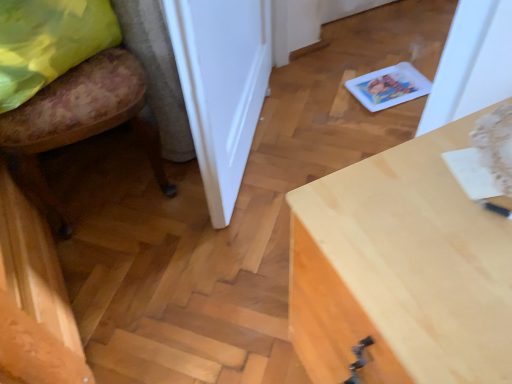
The image size is (512, 384). Describe the element at coordinates (221, 86) in the screenshot. I see `white glossy door at center` at that location.

Find the location of a particular element. yellow fabric pillow at left is located at coordinates (49, 42).

This screenshot has height=384, width=512. Identify the location of floral fabric chair at lower left. (79, 119).

In the image, there is a yellow fabric pillow at left. Identify the location of chair below it (from a real-world perspective). This screenshot has height=384, width=512. (79, 119).

In the scene shown: Is floral fabric chair at lower left surrounded by yellow fabric pillow at left?

No, floral fabric chair at lower left is not surrounded by yellow fabric pillow at left.

Consider the image. Is yellow fabric pillow at left shorter than floral fabric chair at lower left?

Correct, yellow fabric pillow at left is not as tall as floral fabric chair at lower left.

From the image's perspective, is floral fabric chair at lower left located above white glossy door at center?

No, from the image's perspective, floral fabric chair at lower left is not above white glossy door at center.

From a real-world perspective, who is located lower, floral fabric chair at lower left or white glossy door at center?

floral fabric chair at lower left.

Is white glossy door at center located within floral fabric chair at lower left?

No, white glossy door at center is not a part of floral fabric chair at lower left.

The height and width of the screenshot is (384, 512). In order to click on chair below the white glossy door at center (from the image's perspective) in this screenshot , I will do `click(79, 119)`.

Can you confirm if floral fabric chair at lower left is smaller than yellow fabric pillow at left?

No, floral fabric chair at lower left is not smaller than yellow fabric pillow at left.

Which object is wider, floral fabric chair at lower left or yellow fabric pillow at left?

Wider between the two is floral fabric chair at lower left.

Consider the image. From a real-world perspective, between floral fabric chair at lower left and yellow fabric pillow at left, who is vertically lower?

In real-world perspective, floral fabric chair at lower left is lower.

Is floral fabric chair at lower left spatially inside yellow fabric pillow at left, or outside of it?

floral fabric chair at lower left exists outside the volume of yellow fabric pillow at left.

Is white glossy door at center oriented away from yellow fabric pillow at left?

Yes, white glossy door at center is positioned with its back facing yellow fabric pillow at left.

Which object is thinner, white glossy door at center or yellow fabric pillow at left?

With smaller width is white glossy door at center.

Is white glossy door at center next to yellow fabric pillow at left and touching it?

No, white glossy door at center is not touching yellow fabric pillow at left.

At what (x,y) coordinates should I click in order to perform the action: click on door located underneath the yellow fabric pillow at left (from a real-world perspective). Please return your answer as a coordinate pair (x, y). Looking at the image, I should click on (221, 86).

Is light wood desk at center wider than white glossy door at center?

Correct, the width of light wood desk at center exceeds that of white glossy door at center.

Based on their positions, is light wood desk at center located to the left or right of white glossy door at center?

From the image, it's evident that light wood desk at center is to the right of white glossy door at center.

Is light wood desk at center not inside white glossy door at center?

light wood desk at center is positioned outside white glossy door at center.

Considering the positions of objects light wood desk at center and white glossy door at center in the image provided, who is in front, light wood desk at center or white glossy door at center?

light wood desk at center.

Could you tell me if yellow fabric pillow at left is turned towards white glossy door at center?

No.

At what (x,y) coordinates should I click in order to perform the action: click on door on the right side of yellow fabric pillow at left. Please return your answer as a coordinate pair (x, y). This screenshot has height=384, width=512. Looking at the image, I should click on (221, 86).

Can you confirm if yellow fabric pillow at left is wider than white glossy door at center?

Yes, yellow fabric pillow at left is wider than white glossy door at center.

Can you tell me how much yellow fabric pillow at left and white glossy door at center differ in facing direction?

The facing directions of yellow fabric pillow at left and white glossy door at center are 24.5 degrees apart.

Considering the relative positions of white glossy door at center and light wood desk at center in the image provided, is white glossy door at center to the left or to the right of light wood desk at center?

In the image, white glossy door at center appears on the left side of light wood desk at center.

Can you tell me how much white glossy door at center and light wood desk at center differ in facing direction?

The angular difference between white glossy door at center and light wood desk at center is 142 degrees.

Is point (220, 24) in front of point (391, 266)?

No, it is behind (391, 266).

Would you say light wood desk at center is part of white glossy door at center's contents?

No, white glossy door at center does not contain light wood desk at center.

I want to click on chair that is below the yellow fabric pillow at left (from the image's perspective), so click(x=79, y=119).

Locate an element on the screen. Image resolution: width=512 pixels, height=384 pixels. door in front of the floral fabric chair at lower left is located at coordinates (221, 86).

From the image, which object appears to be nearer to floral fabric chair at lower left, white glossy door at center or yellow fabric pillow at left?

The object closer to floral fabric chair at lower left is yellow fabric pillow at left.

Looking at the image, which one is located closer to floral fabric chair at lower left, yellow fabric pillow at left or light wood desk at center?

yellow fabric pillow at left is closer to floral fabric chair at lower left.

Estimate the real-world distances between objects in this image. Which object is further from white glossy door at center, floral fabric chair at lower left or yellow fabric pillow at left?

The object further to white glossy door at center is yellow fabric pillow at left.

When comparing their distances from yellow fabric pillow at left, does light wood desk at center or white glossy door at center seem further?

Based on the image, light wood desk at center appears to be further to yellow fabric pillow at left.

Looking at the image, which one is located further to light wood desk at center, yellow fabric pillow at left or white glossy door at center?

yellow fabric pillow at left.

From the image, which object appears to be nearer to floral fabric chair at lower left, yellow fabric pillow at left or white glossy door at center?

Based on the image, yellow fabric pillow at left appears to be nearer to floral fabric chair at lower left.

Estimate the real-world distances between objects in this image. Which object is closer to floral fabric chair at lower left, light wood desk at center or white glossy door at center?

white glossy door at center lies closer to floral fabric chair at lower left than the other object.

Considering their positions, is floral fabric chair at lower left positioned closer to yellow fabric pillow at left than light wood desk at center?

floral fabric chair at lower left lies closer to yellow fabric pillow at left than the other object.

Image resolution: width=512 pixels, height=384 pixels. What are the coordinates of `door between yellow fabric pillow at left and light wood desk at center from left to right` in the screenshot? It's located at (221, 86).

Identify the location of door situated between floral fabric chair at lower left and light wood desk at center from left to right. (221, 86).

Find the location of a particular element. chair located between yellow fabric pillow at left and white glossy door at center in the left-right direction is located at coordinates (79, 119).

This screenshot has height=384, width=512. Find the location of `chair between yellow fabric pillow at left and light wood desk at center`. chair between yellow fabric pillow at left and light wood desk at center is located at coordinates (79, 119).